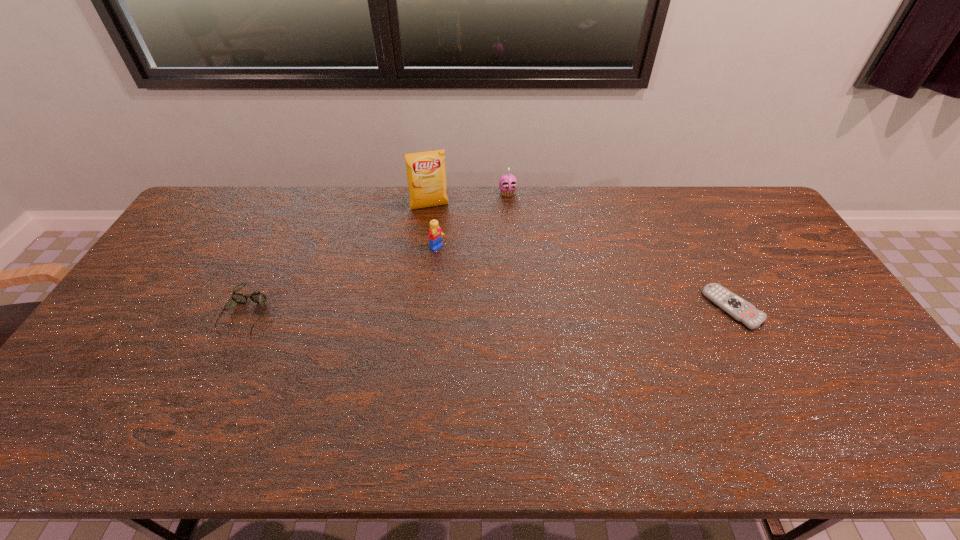
At what (x,y) coordinates should I click in order to perform the action: click on crisp (potato chip) at the far edge. Please return your answer as a coordinate pair (x, y). Image resolution: width=960 pixels, height=540 pixels. Looking at the image, I should click on (426, 174).

Image resolution: width=960 pixels, height=540 pixels. What are the coordinates of `cupcake positioned at the far edge` in the screenshot? It's located at (507, 183).

Locate an element on the screen. vacant area at the far edge is located at coordinates (273, 203).

The height and width of the screenshot is (540, 960). I want to click on blank space at the right edge, so click(760, 250).

Find the location of a particular element. The image size is (960, 540). free spot at the near left corner of the desktop is located at coordinates (100, 384).

At what (x,y) coordinates should I click in order to perform the action: click on vacant space at the far right corner of the desktop. Please return your answer as a coordinate pair (x, y). Looking at the image, I should click on (716, 188).

Locate an element on the screen. The image size is (960, 540). vacant area that lies between the Lego and the cupcake is located at coordinates (472, 221).

Locate an element on the screen. This screenshot has height=540, width=960. free area in between the cupcake and the rightmost object is located at coordinates (620, 251).

Locate an element on the screen. unoccupied position between the cupcake and the third nearest object is located at coordinates (472, 221).

The width and height of the screenshot is (960, 540). What are the coordinates of `free space between the leftmost object and the crisp (potato chip)` in the screenshot? It's located at (338, 260).